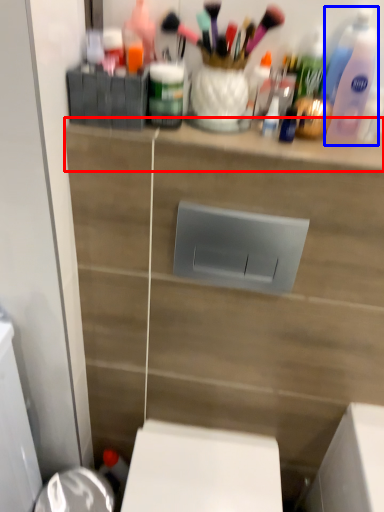
Question: Which point is closer to the camera, ledge (highlighted by a red box) or cleaning product (highlighted by a blue box)?

Choices:
 (A) ledge
 (B) cleaning product

Answer: (B)